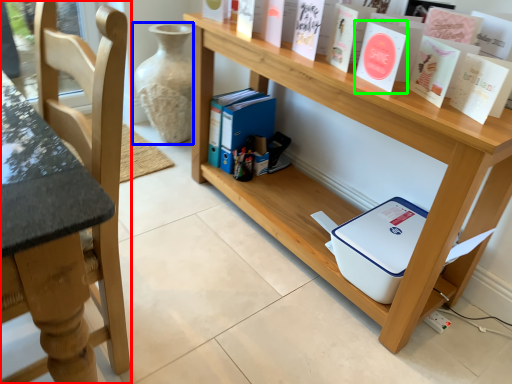
Question: Based on their relative distances, which object is farther from chair (highlighted by a red box)? Choose from glass vase (highlighted by a blue box) and paperback book (highlighted by a green box).

Choices:
 (A) glass vase
 (B) paperback book

Answer: (A)